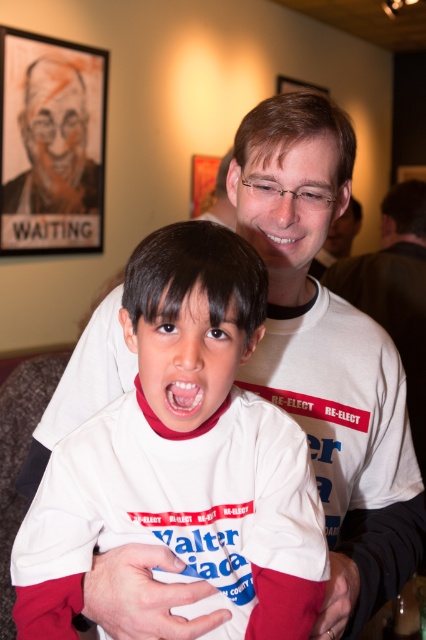
Between point (14, 252) and point (195, 412), which one is positioned behind?

Positioned behind is point (14, 252).

Is black paper picture frame at upper left thinner than bright white teeth at center?

No.

Which is in front, point (49, 134) or point (160, 381)?

Point (160, 381)

Where is `black paper picture frame at upper left`? The width and height of the screenshot is (426, 640). black paper picture frame at upper left is located at coordinates (51, 145).

Does point (279, 499) come farther from viewer compared to point (299, 88)?

No, it is not.

Does white cotton shirt at center have a lesser width compared to wooden picture frame at upper center?

Yes.

Identify the location of white cotton shirt at center. (184, 458).

Does white t-shirt at center have a lesser height compared to wooden picture frame at upper center?

Incorrect, white t-shirt at center's height does not fall short of wooden picture frame at upper center's.

Is point (380, 316) positioned behind point (310, 90)?

Yes, point (380, 316) is farther from viewer.

Is point (400, 192) behind point (288, 86)?

No, it is not.

You are a GUI agent. You are given a task and a screenshot of the screen. Output one action in this format:
    pyautogui.click(x=<x>, y=<y>)
    Task: Click on the white t-shirt at center
    
    Given the screenshot: What is the action you would take?
    pyautogui.click(x=396, y=292)